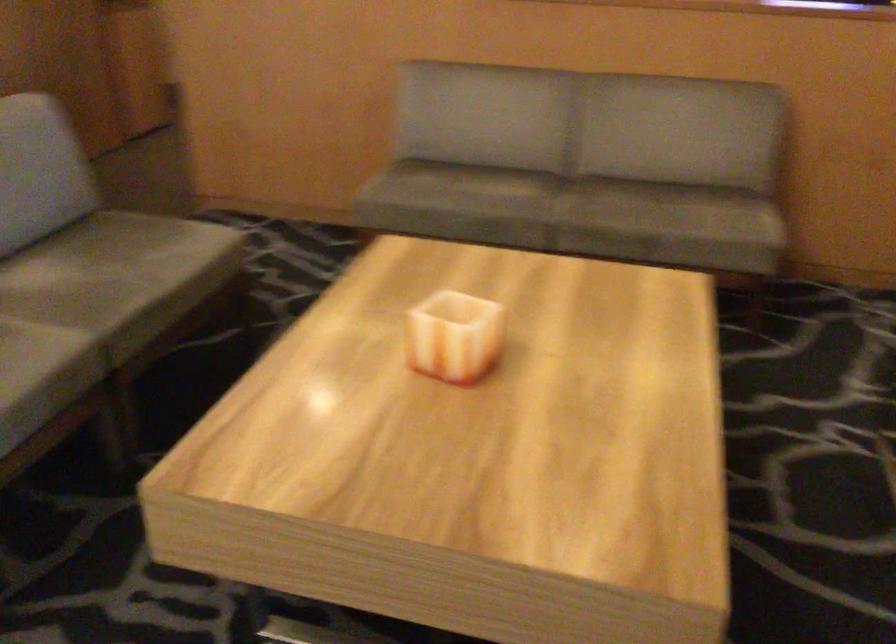
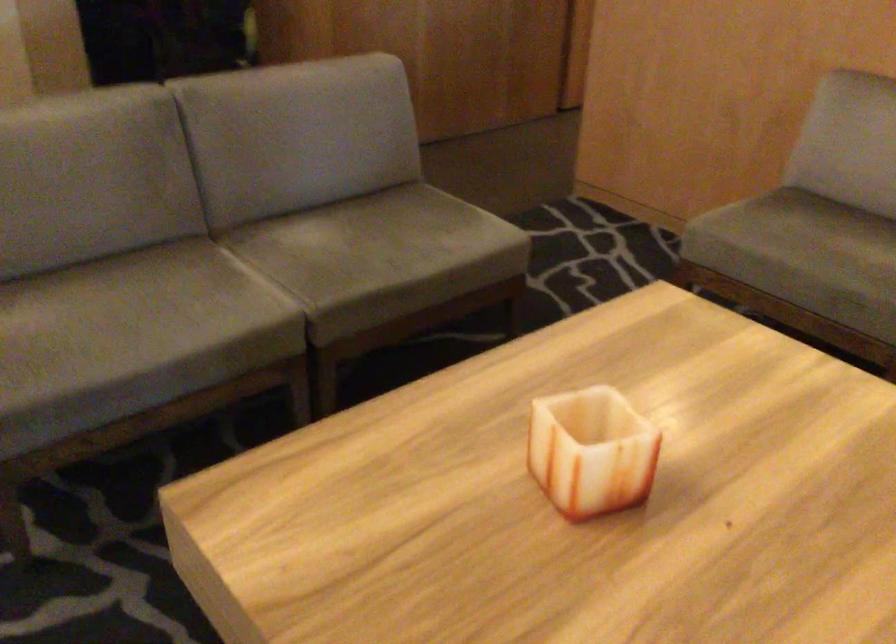
Question: The first image is from the beginning of the video and the second image is from the end. How did the camera likely rotate when shooting the video?

Choices:
 (A) Left
 (B) Right
 (C) Up
 (D) Down

Answer: (A)